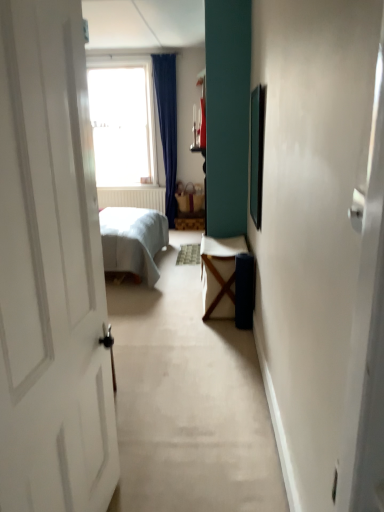
Question: Should I look upward or downward to see wooden table at center?

Choices:
 (A) down
 (B) up

Answer: (A)

Question: Is matte brown wicker basket at center thinner than wooden table at center?

Choices:
 (A) yes
 (B) no

Answer: (A)

Question: From the image's perspective, is matte brown wicker basket at center on wooden table at center?

Choices:
 (A) yes
 (B) no

Answer: (A)

Question: Is there a large distance between matte brown wicker basket at center and wooden table at center?

Choices:
 (A) yes
 (B) no

Answer: (A)

Question: Is matte brown wicker basket at center completely or partially outside of wooden table at center?

Choices:
 (A) no
 (B) yes

Answer: (B)

Question: Is matte brown wicker basket at center closer to the viewer compared to wooden table at center?

Choices:
 (A) yes
 (B) no

Answer: (B)

Question: Is matte brown wicker basket at center bigger than wooden table at center?

Choices:
 (A) yes
 (B) no

Answer: (B)

Question: Does wooden table at center appear on the left side of matte brown wicker basket at center?

Choices:
 (A) yes
 (B) no

Answer: (B)

Question: Is wooden table at center turned away from matte brown wicker basket at center?

Choices:
 (A) no
 (B) yes

Answer: (A)

Question: Is wooden table at center taller than matte brown wicker basket at center?

Choices:
 (A) no
 (B) yes

Answer: (B)

Question: Can you confirm if wooden table at center is shorter than matte brown wicker basket at center?

Choices:
 (A) yes
 (B) no

Answer: (B)

Question: Would you say wooden table at center is outside matte brown wicker basket at center?

Choices:
 (A) no
 (B) yes

Answer: (B)

Question: Is wooden table at center facing towards matte brown wicker basket at center?

Choices:
 (A) no
 (B) yes

Answer: (A)

Question: Does matte brown wicker basket at center lie in front of transparent glass window at upper center?

Choices:
 (A) no
 (B) yes

Answer: (A)